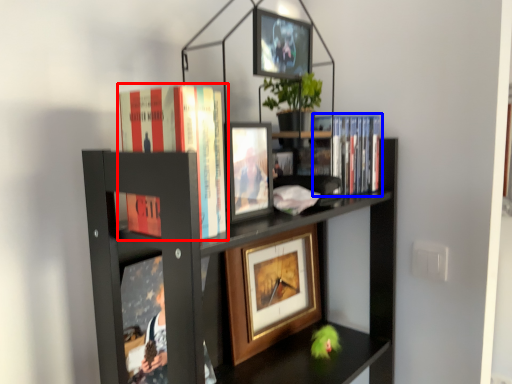
Question: Which of the following is the farthest to the observer, book (highlighted by a red box) or book (highlighted by a blue box)?

Choices:
 (A) book
 (B) book

Answer: (B)